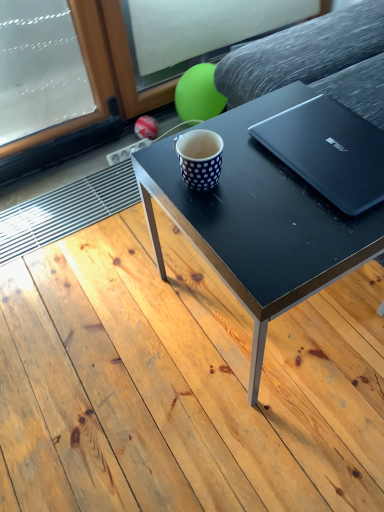
Identify the location of vacant point above black matte laptop at upper right (from a real-world perspective). The width and height of the screenshot is (384, 512). (329, 139).